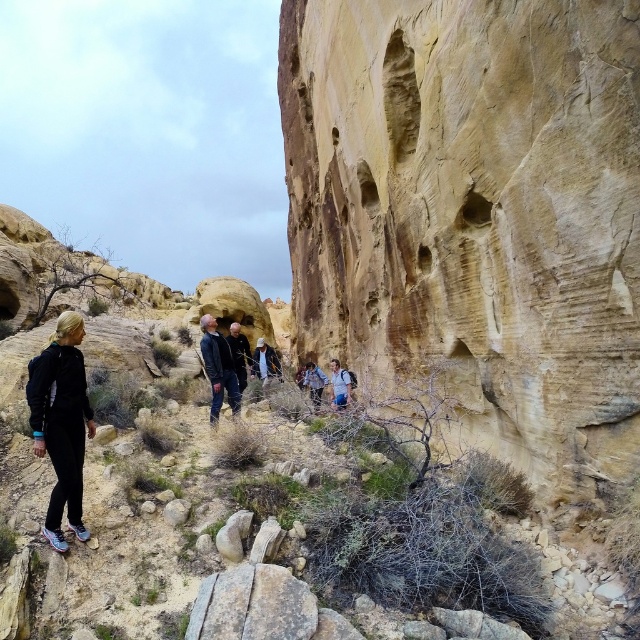
You are a hiker trying to navigate through the desert. You see the yellow sandstone rock face at center and the dark gray jacket at center. Which object is wider?

The yellow sandstone rock face at center is wider than the dark gray jacket at center.

Consider the image. You are a hiker trying to navigate the path between the yellow sandstone rock face at center and the black matte pants at left. Which object is closer to you as you stand at the starting point?

The yellow sandstone rock face at center is closer to the viewer than the black matte pants at left, so the rock face would be the first object encountered.